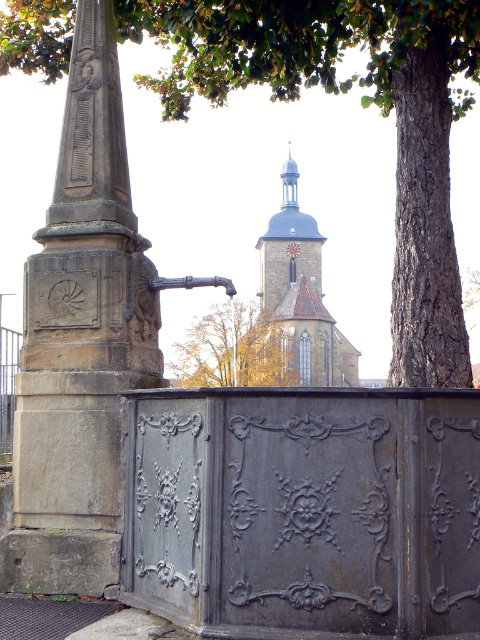
You are standing in front of the historical stone fountain. There are two points marked on the fountain. One is at point coordinates point [322,369] and the other is at point [227,332]. Which point is closer to you?

Point [227,332] is closer to you because it is in front of point [322,369].

You are standing in a historical square and see the rustic stone fountain at left and the smooth gray stone tower at center. Which object is positioned to the left of the other?

The rustic stone fountain at left is positioned to the left of the smooth gray stone tower at center.